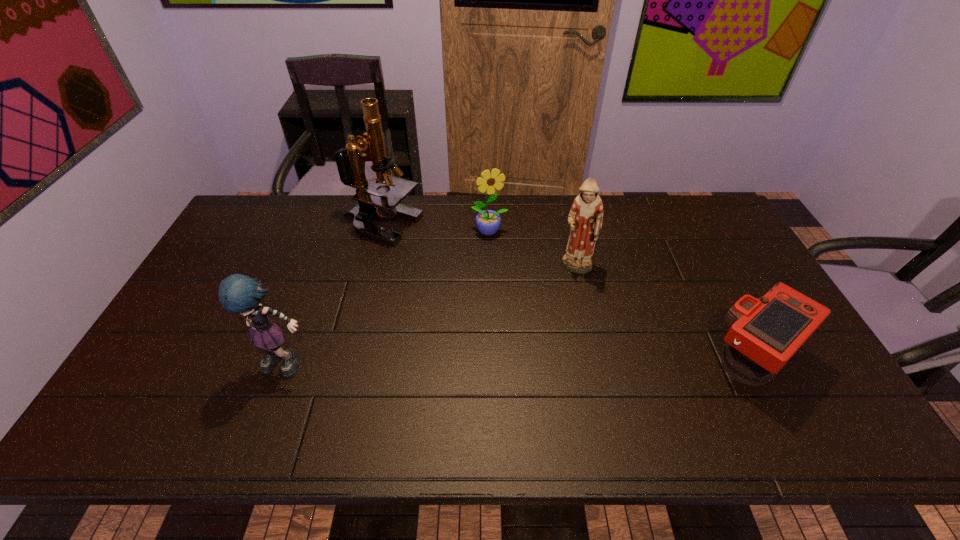
Find the location of a particular element. This screenshot has height=540, width=960. rag doll is located at coordinates (239, 294).

Find the location of a particular element. This screenshot has width=960, height=540. the shortest object is located at coordinates (765, 332).

Find the location of a particular element. camera is located at coordinates (765, 332).

You are a GUI agent. You are given a task and a screenshot of the screen. Output one action in this format:
    pyautogui.click(x=<x>, y=<y>)
    Task: Click on the microscope
    
    Given the screenshot: What is the action you would take?
    pyautogui.click(x=350, y=162)

Locate an element on the screen. The image size is (960, 540). the third nearest object is located at coordinates pos(585,219).

The height and width of the screenshot is (540, 960). What are the coordinates of `the second object from right to left` in the screenshot? It's located at (585, 219).

This screenshot has width=960, height=540. Find the location of `sunflower`. sunflower is located at coordinates (488, 222).

The width and height of the screenshot is (960, 540). I want to click on the fourth tallest object, so pos(488,222).

At what (x,y) coordinates should I click in order to perform the action: click on free location located on the left of the camera. Please return your answer as a coordinate pair (x, y). Looking at the image, I should click on (632, 361).

Locate an element on the screen. vacant space situated 0.220m at the eyepiece of the microscope is located at coordinates tap(445, 278).